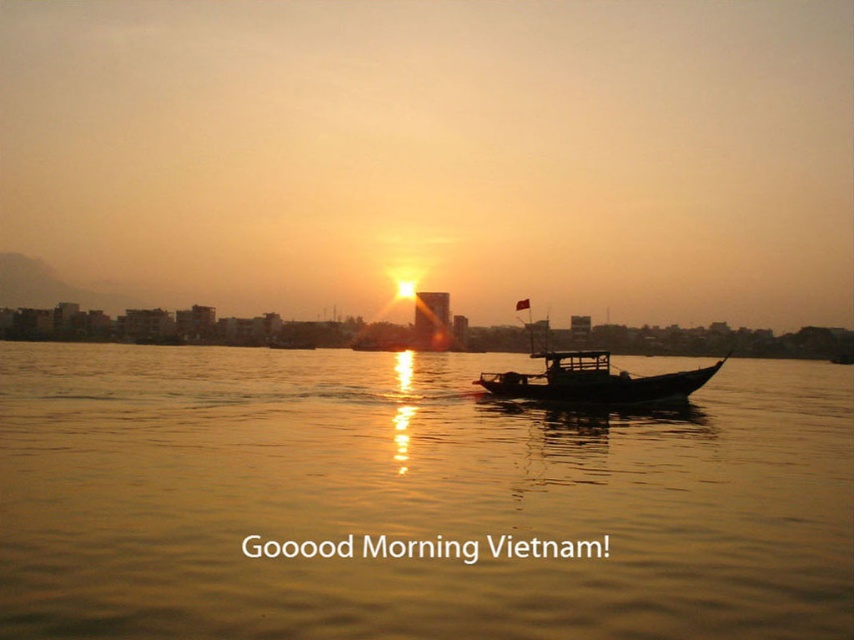
Question: Which object is the closest to the wooden boat at center?

Choices:
 (A) wooden canoe at center
 (B) golden reflective water at center

Answer: (A)

Question: From the image, what is the correct spatial relationship of wooden boat at center in relation to wooden canoe at center?

Choices:
 (A) below
 (B) above

Answer: (B)

Question: Which object is positioned closest to the golden reflective water at center?

Choices:
 (A) wooden canoe at center
 (B) wooden boat at center

Answer: (B)

Question: Is wooden boat at center closer to the viewer compared to wooden canoe at center?

Choices:
 (A) no
 (B) yes

Answer: (B)

Question: Is golden reflective water at center bigger than wooden canoe at center?

Choices:
 (A) yes
 (B) no

Answer: (A)

Question: Among these points, which one is farthest from the camera?

Choices:
 (A) (636, 396)
 (B) (420, 416)
 (C) (492, 385)

Answer: (C)